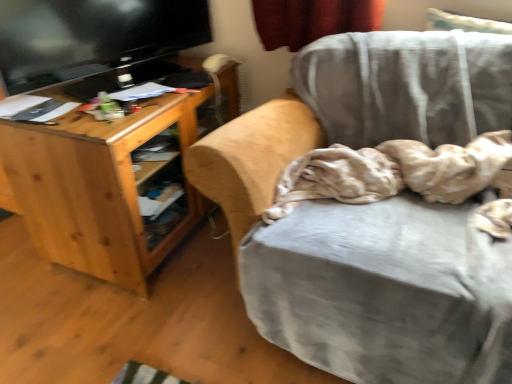
Find the location of `free space in front of natural wood desk at left`. free space in front of natural wood desk at left is located at coordinates (109, 317).